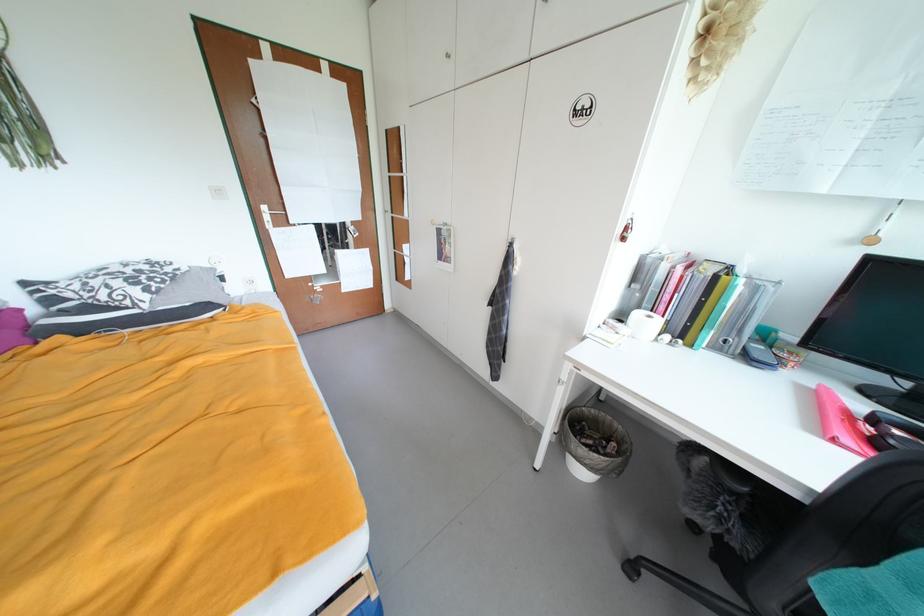
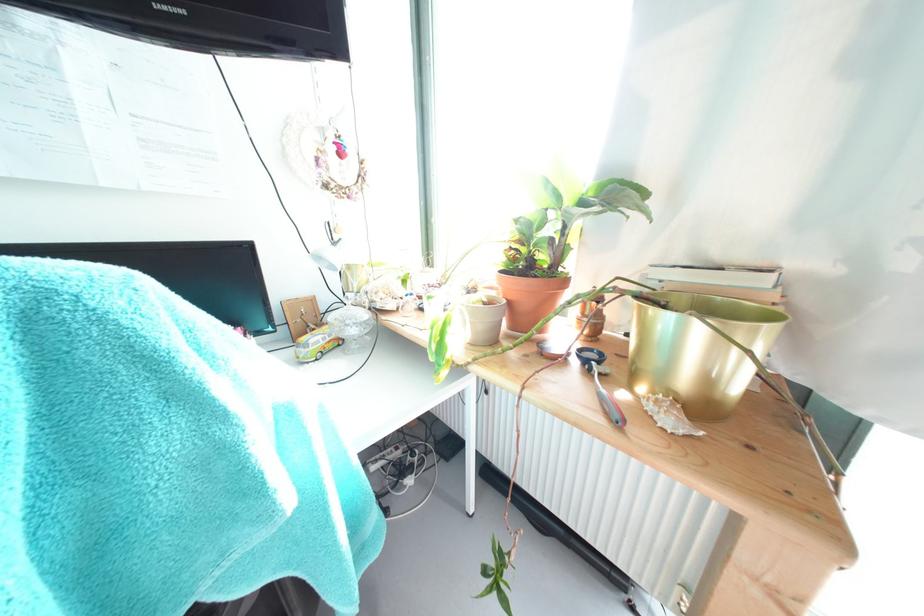
The first image is from the beginning of the video and the second image is from the end. How did the camera likely rotate when shooting the video?

The camera rotated toward right-down.